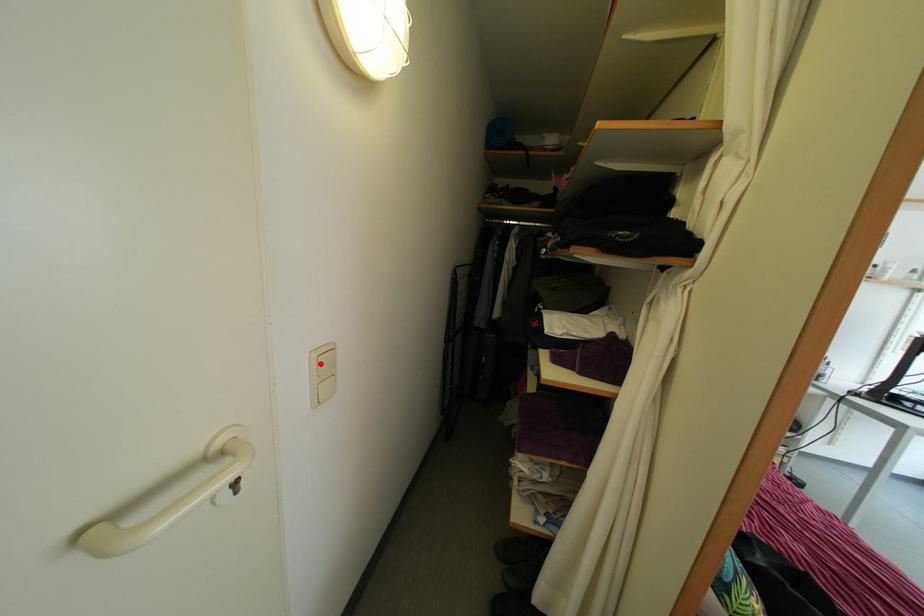
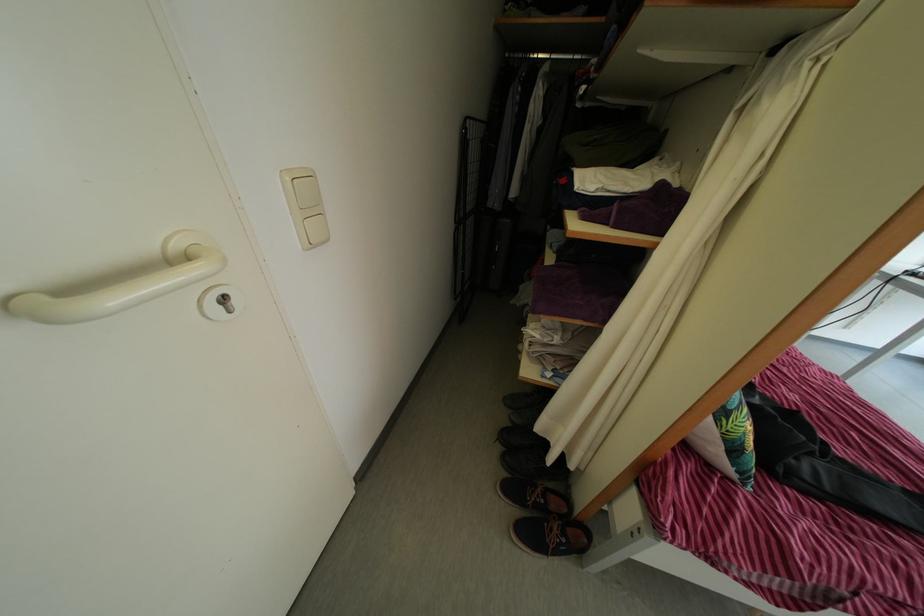
Locate, in the second image, the point that corresponds to the highlighted location in the first image.

(295, 187)